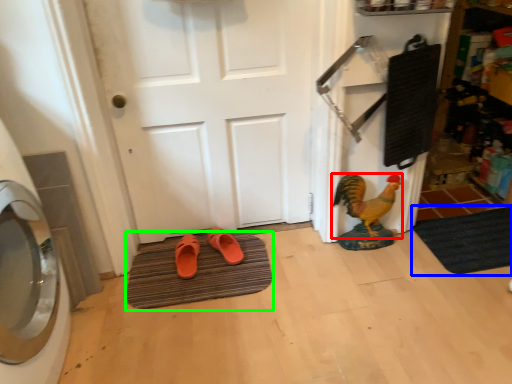
Question: Estimate the real-world distances between objects in this image. Which object is farther from chicken (highlighted by a red box), bath mat (highlighted by a blue box) or bath mat (highlighted by a green box)?

Choices:
 (A) bath mat
 (B) bath mat

Answer: (B)